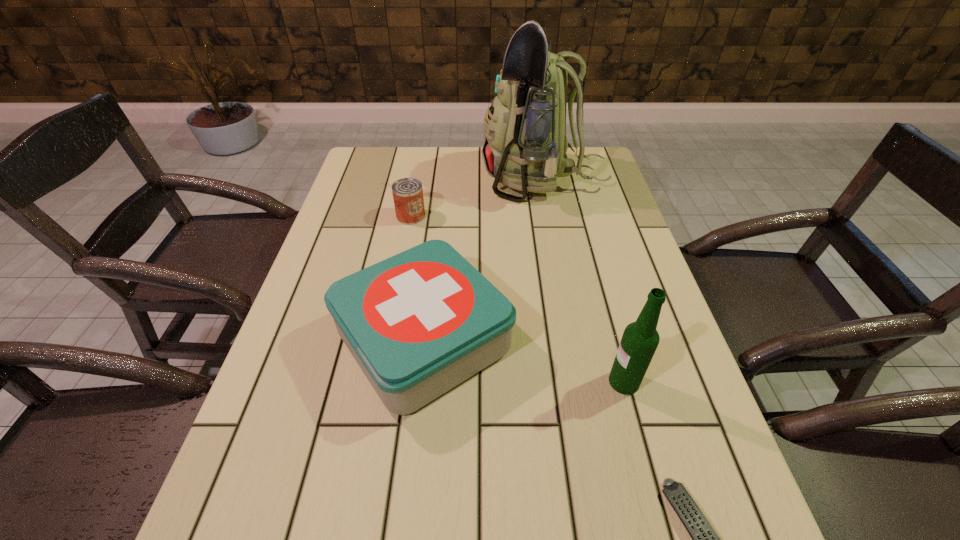
You are a GUI agent. You are given a task and a screenshot of the screen. Output one action in this format:
    pyautogui.click(x=<x>, y=<y>)
    Task: Click on the tallest object
    
    Given the screenshot: What is the action you would take?
    pyautogui.click(x=525, y=142)

Where is `beer bottle`? Image resolution: width=960 pixels, height=540 pixels. beer bottle is located at coordinates (640, 339).

Identify the location of the third shortest object. The width and height of the screenshot is (960, 540). (419, 323).

Image resolution: width=960 pixels, height=540 pixels. In order to click on can in this screenshot , I will do `click(407, 193)`.

At what (x,y) coordinates should I click in order to perform the action: click on vacant region located 0.340m on the front-facing side of the tallest object. Please return your answer as a coordinate pair (x, y). This screenshot has width=960, height=540. Looking at the image, I should click on (374, 179).

Where is `vacant area located 0.130m on the front-facing side of the tallest object`? This screenshot has width=960, height=540. vacant area located 0.130m on the front-facing side of the tallest object is located at coordinates (441, 179).

Where is `free space located 0.210m on the front-facing side of the tallest object`? The image size is (960, 540). free space located 0.210m on the front-facing side of the tallest object is located at coordinates (416, 179).

This screenshot has width=960, height=540. I want to click on free space located 0.140m on the label of the beer bottle, so click(538, 382).

The image size is (960, 540). I want to click on vacant area located on the label of the beer bottle, so click(x=482, y=382).

Find the location of a particular element. The height and width of the screenshot is (540, 960). vacant space located on the label of the beer bottle is located at coordinates (584, 382).